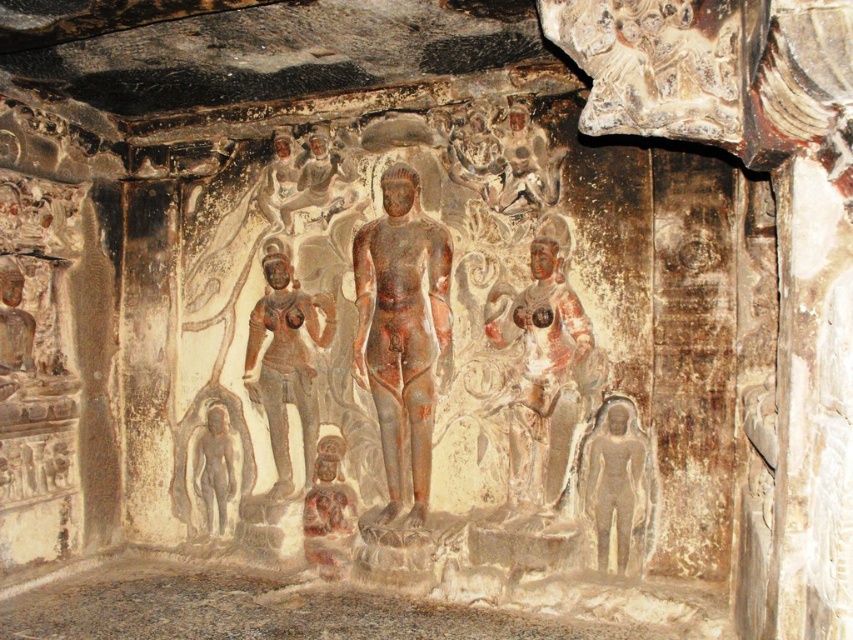
Is the position of reddish-brown stone statue at center-right less distant than that of smooth gray statue at lower left?

Yes, it is.

Describe the element at coordinates (540, 374) in the screenshot. I see `reddish-brown stone statue at center-right` at that location.

Find the location of a particular element. This screenshot has width=853, height=640. reddish-brown stone statue at center-right is located at coordinates (540, 374).

Can you confirm if gray stone statue at lower right is bigger than smooth gray statue at lower left?

Yes, gray stone statue at lower right is bigger than smooth gray statue at lower left.

Is gray stone statue at lower right thinner than smooth gray statue at lower left?

No.

The width and height of the screenshot is (853, 640). I want to click on gray stone statue at lower right, so click(614, 477).

Where is `gray stone statue at lower right`? The height and width of the screenshot is (640, 853). gray stone statue at lower right is located at coordinates (614, 477).

What do you see at coordinates (286, 358) in the screenshot?
I see `brown stone statue at center` at bounding box center [286, 358].

Looking at this image, measure the distance between brown stone statue at center and camera.

The distance of brown stone statue at center from camera is 3.48 meters.

This screenshot has height=640, width=853. In order to click on brown stone statue at center in this screenshot , I will do `click(286, 358)`.